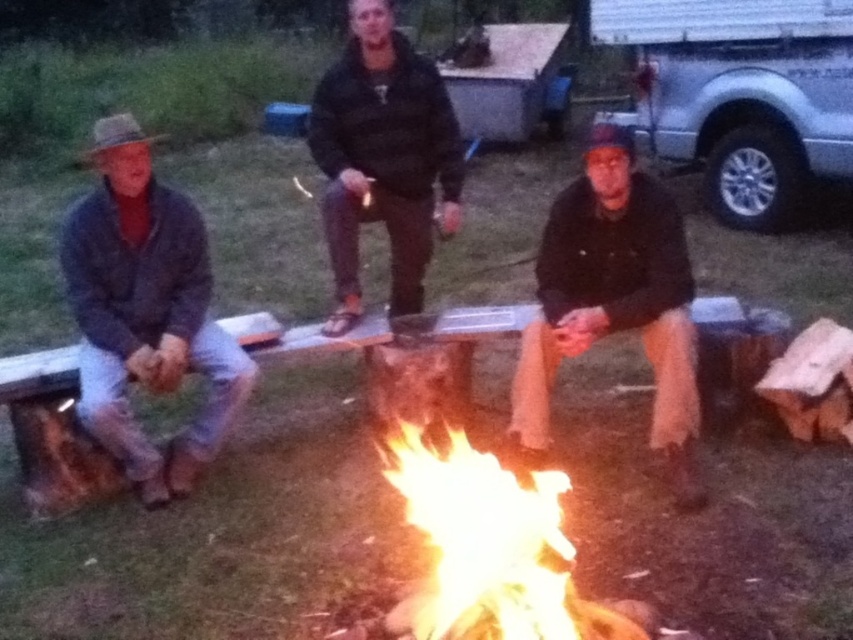
Between dark brown leather jacket at center and black matte jacket at center, which one is positioned lower?

dark brown leather jacket at center is below.

Does dark brown leather jacket at center appear over black matte jacket at center?

Actually, dark brown leather jacket at center is below black matte jacket at center.

Does point (544, 225) lie behind point (425, 244)?

Yes.

The width and height of the screenshot is (853, 640). I want to click on dark brown leather jacket at center, so click(x=614, y=300).

Is denim jacket at left in front of flaming wood at center?

No, it is not.

Does denim jacket at left appear on the left side of flaming wood at center?

Correct, you'll find denim jacket at left to the left of flaming wood at center.

Find the location of a particular element. Image resolution: width=853 pixels, height=640 pixels. denim jacket at left is located at coordinates 144,312.

Identify the location of denim jacket at left. This screenshot has height=640, width=853. (144, 312).

Does point (503, 564) come farther from viewer compared to point (396, 150)?

That is False.

Does point (428, 536) come closer to viewer compared to point (341, 259)?

Yes, it is in front of point (341, 259).

The width and height of the screenshot is (853, 640). In order to click on flaming wood at center in this screenshot , I will do `click(489, 548)`.